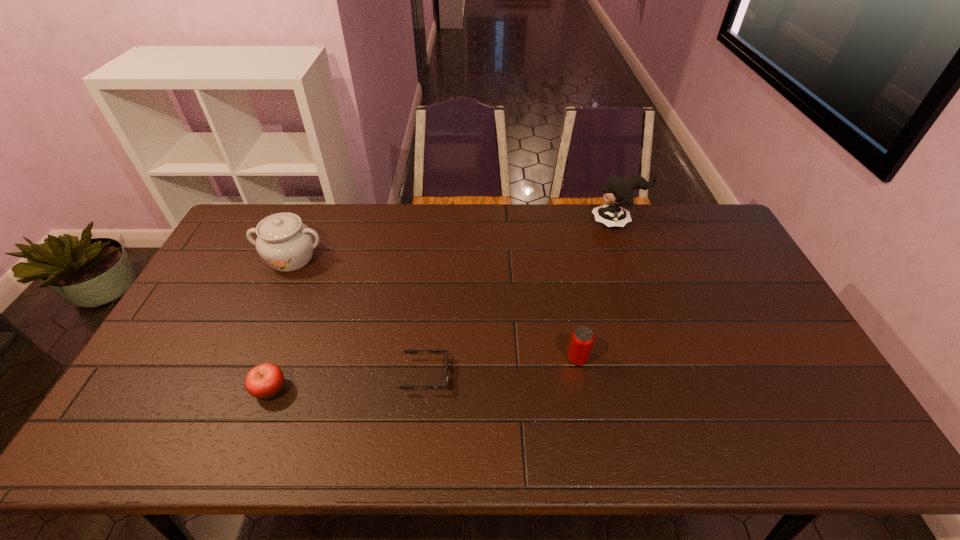
This screenshot has width=960, height=540. In order to click on doll in this screenshot , I will do (618, 192).

Find the location of a particular element. This screenshot has height=540, width=960. the tallest object is located at coordinates (618, 192).

The height and width of the screenshot is (540, 960). In order to click on chinaware in this screenshot , I will do `click(286, 244)`.

Find the location of `the second farthest object`. the second farthest object is located at coordinates (286, 244).

This screenshot has width=960, height=540. In order to click on can in this screenshot , I will do `click(582, 338)`.

Where is `the fourth object from left to right`? Image resolution: width=960 pixels, height=540 pixels. the fourth object from left to right is located at coordinates (582, 338).

This screenshot has width=960, height=540. What are the coordinates of `apple` in the screenshot? It's located at click(264, 381).

Find the location of a particular element. The image size is (960, 540). sunglasses is located at coordinates (409, 351).

Identify the location of the shortest object. The width and height of the screenshot is (960, 540). (409, 351).

You are a GUI agent. You are given a task and a screenshot of the screen. Output one action in this format:
    pyautogui.click(x=<x>, y=<y>)
    Task: Click on the vacant space located 0.360m at the face of the rightmost object
    This screenshot has height=540, width=960.
    Given the screenshot: What is the action you would take?
    pyautogui.click(x=493, y=222)